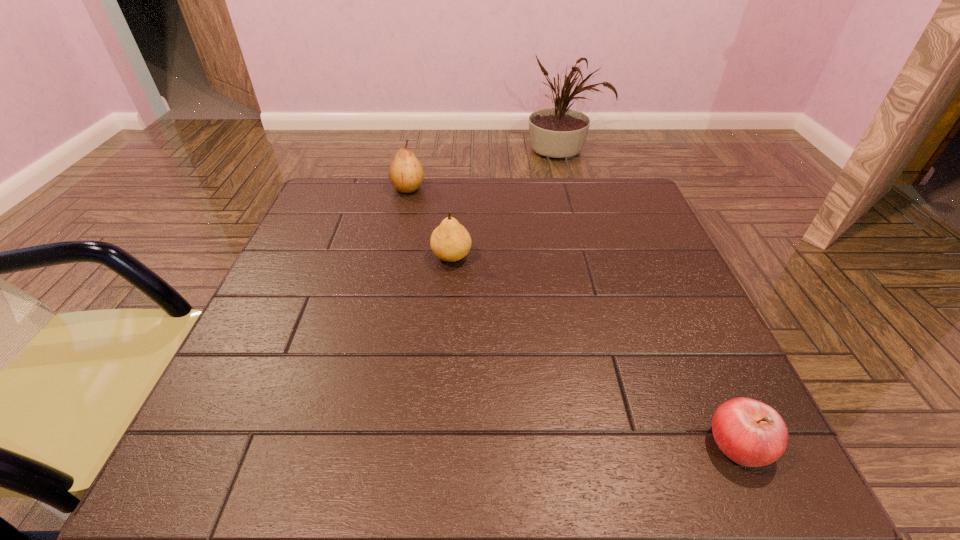
Where is `the left pear`? the left pear is located at coordinates (406, 174).

Where is `the farther pear`? This screenshot has height=540, width=960. the farther pear is located at coordinates (406, 174).

The height and width of the screenshot is (540, 960). I want to click on the nearer pear, so click(x=450, y=241).

This screenshot has height=540, width=960. I want to click on the second farthest object, so click(450, 241).

Where is `apple`? apple is located at coordinates pos(749,432).

I want to click on the nearest object, so click(x=749, y=432).

Identify the location of free space located 0.240m on the right of the farthest object. (511, 188).

Locate an element on the screen. Image resolution: width=960 pixels, height=540 pixels. vacant space located on the right of the second nearest object is located at coordinates (567, 257).

This screenshot has height=540, width=960. Identify the location of free spot located 0.210m on the left of the nearest object. (570, 444).

Identify the location of object at the far edge. The width and height of the screenshot is (960, 540). (406, 174).